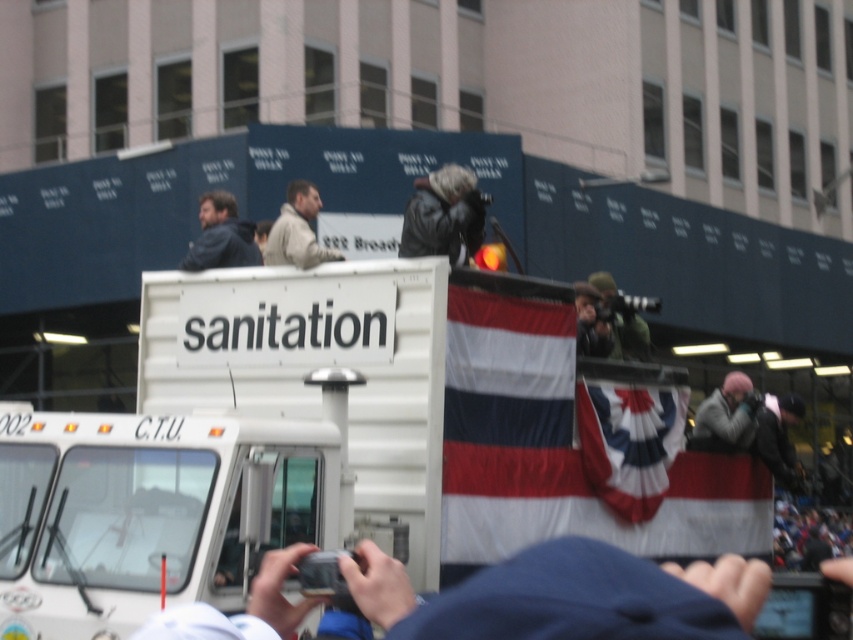
Based on the photo, you are a photographer at the event and want to capture both the red and white striped fabric at upper right and the gray fabric jacket at lower right in a single frame. Which object should you focus on to ensure both are visible without zooming in or out?

Since the red and white striped fabric at upper right is wider than the gray fabric jacket at lower right, you should focus on the red and white striped fabric at upper right as it occupies more space in the frame, allowing the smaller gray fabric jacket at lower right to fit alongside without needing to adjust the zoom.

In the scene shown: You are a photographer at the event. You need to capture both the red and white striped fabric at upper right and the gray fabric jacket at lower right in the same frame. Which object should you focus on first to ensure both are in the frame?

The red and white striped fabric at upper right is taller than the gray fabric jacket at lower right. To capture both in the same frame, focus on the taller object first, ensuring there is enough space for the shorter one below it. Start by framing the red and white striped fabric at upper right and adjust the camera angle downward to include the gray fabric jacket at lower right.